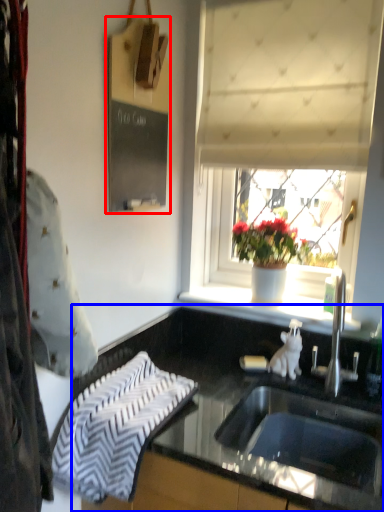
Question: Which object is further to the camera taking this photo, bulletin board (highlighted by a red box) or countertop (highlighted by a blue box)?

Choices:
 (A) bulletin board
 (B) countertop

Answer: (A)